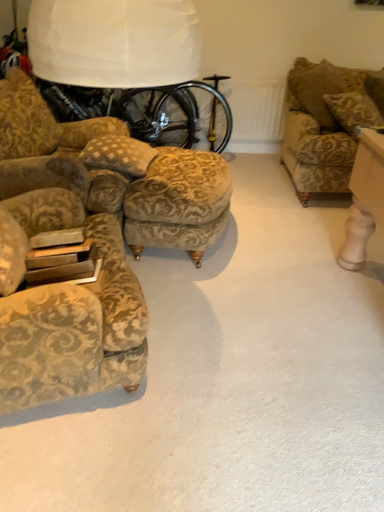
Question: Is velvet floral armchair at left closer to camera compared to patterned fabric pillow at center?

Choices:
 (A) no
 (B) yes

Answer: (B)

Question: Does velvet floral armchair at left appear on the right side of patterned fabric pillow at center?

Choices:
 (A) yes
 (B) no

Answer: (B)

Question: Is patterned fabric pillow at center located within velvet floral armchair at left?

Choices:
 (A) yes
 (B) no

Answer: (B)

Question: Considering the relative sizes of velvet floral armchair at left and patterned fabric pillow at center in the image provided, is velvet floral armchair at left shorter than patterned fabric pillow at center?

Choices:
 (A) no
 (B) yes

Answer: (A)

Question: Does velvet floral armchair at left have a lesser width compared to patterned fabric pillow at center?

Choices:
 (A) yes
 (B) no

Answer: (B)

Question: Relative to velvet floral armchair at left, is patterned fabric pillow at center in front or behind?

Choices:
 (A) behind
 (B) front

Answer: (A)

Question: Is patterned fabric pillow at center to the left or to the right of velvet floral armchair at left in the image?

Choices:
 (A) right
 (B) left

Answer: (A)

Question: Is point (144, 175) closer or farther from the camera than point (125, 388)?

Choices:
 (A) farther
 (B) closer

Answer: (A)

Question: Is patterned fabric pillow at center taller or shorter than velvet floral armchair at left?

Choices:
 (A) short
 (B) tall

Answer: (A)

Question: Is gold-patterned fabric stool at center in front of or behind velvet floral armchair at left in the image?

Choices:
 (A) front
 (B) behind

Answer: (B)

Question: From a real-world perspective, is gold-patterned fabric stool at center above or below velvet floral armchair at left?

Choices:
 (A) below
 (B) above

Answer: (A)

Question: In terms of size, does gold-patterned fabric stool at center appear bigger or smaller than velvet floral armchair at left?

Choices:
 (A) big
 (B) small

Answer: (B)

Question: Considering the positions of point (163, 200) and point (91, 333), is point (163, 200) closer or farther from the camera than point (91, 333)?

Choices:
 (A) closer
 (B) farther

Answer: (B)

Question: Is gold-patterned fabric stool at center bigger or smaller than patterned fabric pillow at center?

Choices:
 (A) big
 (B) small

Answer: (A)

Question: Is point (170, 215) closer or farther from the camera than point (84, 147)?

Choices:
 (A) closer
 (B) farther

Answer: (A)